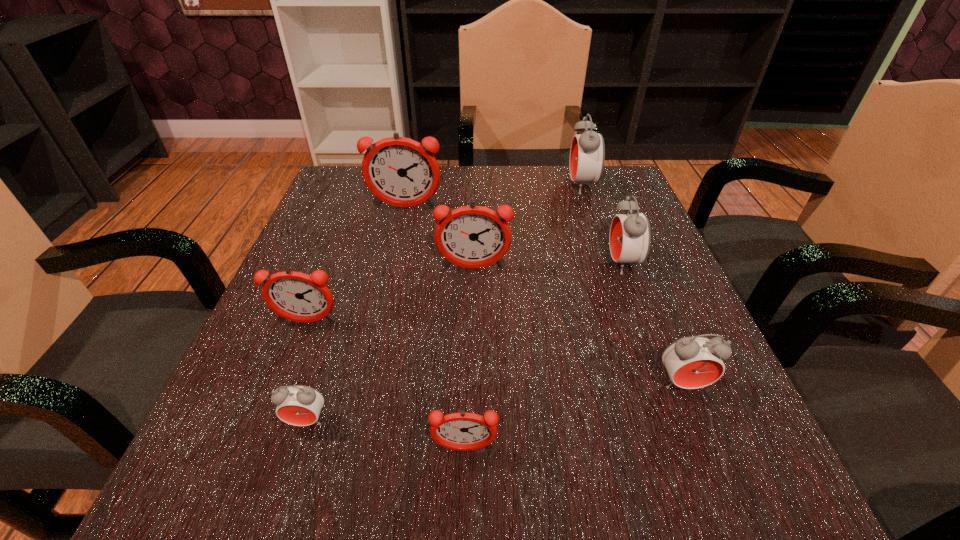
Where is `the nearest reddish-pink alarm clock`? This screenshot has height=540, width=960. the nearest reddish-pink alarm clock is located at coordinates (463, 431).

What are the coordinates of `the nearest object` in the screenshot? It's located at (463, 431).

Locate an element on the screen. the second nearest alarm clock is located at coordinates (298, 405).

Locate an element on the screen. the seventh farthest object is located at coordinates (298, 405).

Where is `vacant area situated 0.120m on the face of the biggest red alarm clock`? The image size is (960, 540). vacant area situated 0.120m on the face of the biggest red alarm clock is located at coordinates (520, 187).

Identify the location of blank area located 0.110m on the face of the biggest red alarm clock. The image size is (960, 540). (524, 187).

Find the location of a particular element. The width and height of the screenshot is (960, 540). free location located 0.270m on the face of the biggest red alarm clock is located at coordinates (460, 187).

Where is `free space located on the front-facing side of the seventh nearest object`? The height and width of the screenshot is (540, 960). free space located on the front-facing side of the seventh nearest object is located at coordinates tap(394, 263).

Find the location of a particular element. The height and width of the screenshot is (540, 960). free spot located 0.320m on the face of the second farthest red alarm clock is located at coordinates (447, 264).

You are a GUI agent. You are given a task and a screenshot of the screen. Output one action in this format:
    pyautogui.click(x=<x>, y=<y>)
    Task: Click on the vacant space located on the face of the second farthest red alarm clock
    This screenshot has height=540, width=960.
    Given the screenshot: What is the action you would take?
    coord(518,264)